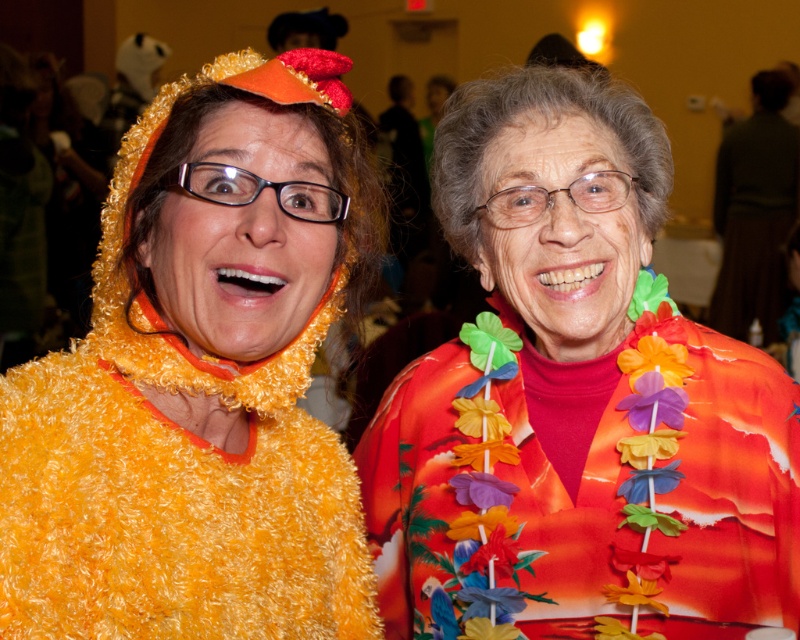
Which is in front, point (121, 224) or point (720, 621)?

Point (121, 224) is in front.

Is fuzzy yellow costume at left thinner than floral fabric lei at center?

Yes.

Looking at this image, who is more distant from viewer, (x=46, y=369) or (x=766, y=486)?

The point (x=766, y=486) is behind.

This screenshot has height=640, width=800. I want to click on fuzzy yellow costume at left, so click(200, 381).